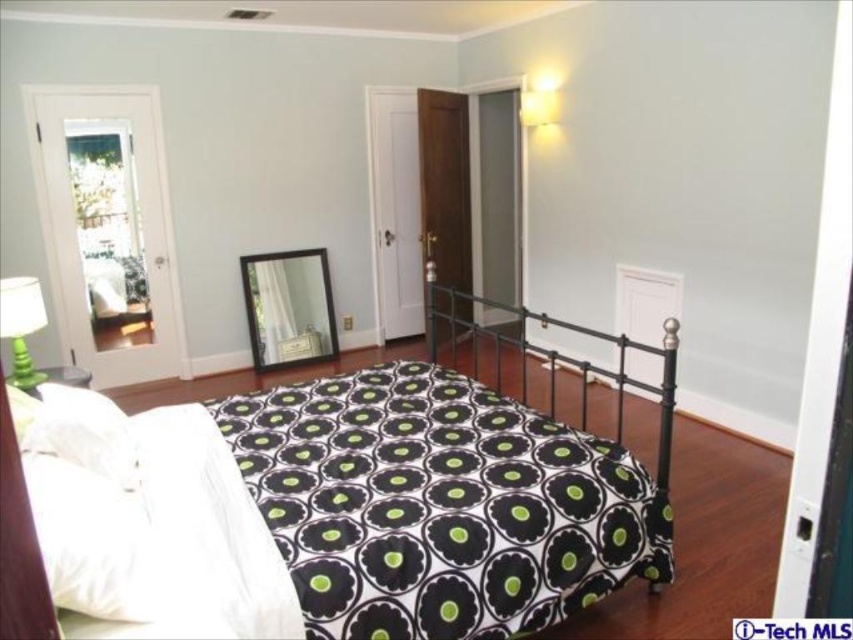
Which is more to the right, black matte bed at center or white soft pillow at lower left?

black matte bed at center

Who is more distant from viewer, [198,492] or [125,435]?

The point [125,435] is more distant.

Between point (38, 480) and point (71, 406), which one is positioned behind?

Positioned behind is point (71, 406).

Where is `black matte bed at center`? This screenshot has width=853, height=640. black matte bed at center is located at coordinates (334, 509).

Between white soft pillow at lower left and matte white lampshade at upper right, which one has less height?

With less height is white soft pillow at lower left.

In the scene shown: Which is below, white soft pillow at lower left or matte white lampshade at upper right?

Positioned lower is white soft pillow at lower left.

Which is in front, point (68, 416) or point (531, 113)?

Positioned in front is point (68, 416).

The width and height of the screenshot is (853, 640). What are the coordinates of `white soft pillow at lower left` in the screenshot? It's located at (82, 433).

The image size is (853, 640). What do you see at coordinates (21, 324) in the screenshot?
I see `green matte lampshade at left` at bounding box center [21, 324].

Locate an element on the screen. This screenshot has width=853, height=640. green matte lampshade at left is located at coordinates (21, 324).

This screenshot has height=640, width=853. I want to click on green matte lampshade at left, so click(21, 324).

The image size is (853, 640). Identify the location of green matte lampshade at left. (21, 324).